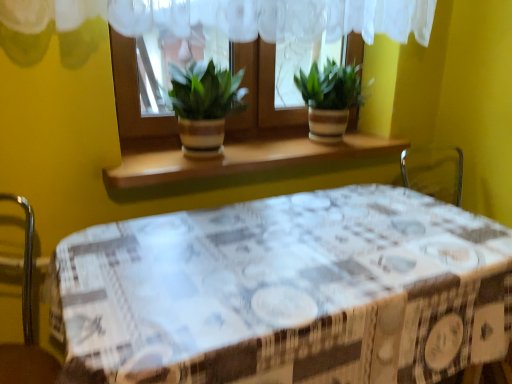
Question: In terms of width, does green leafy plant at center look wider or thinner when compared to matte brown pot at center, marked as the 1th houseplant in a left-to-right arrangement?

Choices:
 (A) wide
 (B) thin

Answer: (B)

Question: Based on their positions, is green leafy plant at center located to the left or right of matte brown pot at center, marked as the 1th houseplant in a left-to-right arrangement?

Choices:
 (A) left
 (B) right

Answer: (B)

Question: Which object is positioned closest to the matte brown pot at center, marked as the 1th houseplant in a left-to-right arrangement?

Choices:
 (A) green striped pot at center, which ranks as the 1th houseplant in right-to-left order
 (B) green leafy plant at center
 (C) white printed tablecloth at center
 (D) wooden at center

Answer: (B)

Question: Which object is the closest to the white printed tablecloth at center?

Choices:
 (A) green leafy plant at center
 (B) matte brown pot at center, marked as the 1th houseplant in a left-to-right arrangement
 (C) green striped pot at center, which ranks as the 1th houseplant in right-to-left order
 (D) wooden at center

Answer: (D)